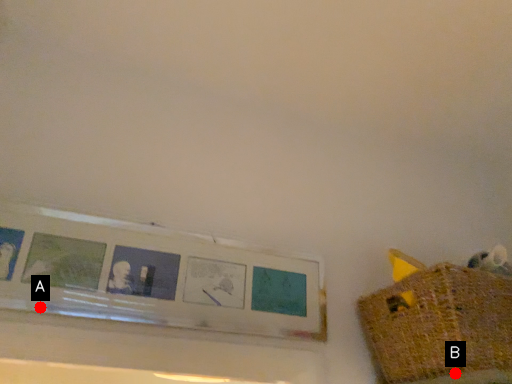
Question: Two points are circled on the image, labeled by A and B beside each circle. Which point is closer to the camera taking this photo?

Choices:
 (A) A is closer
 (B) B is closer

Answer: (B)